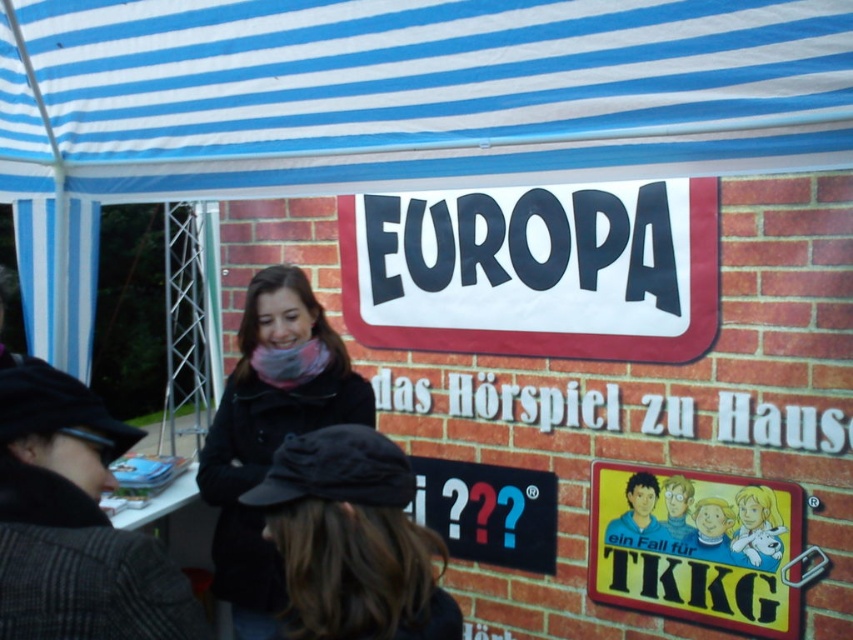
You are standing in front of the brick wall and want to hang a small picture frame that is 10 inches wide between the blue striped canopy at upper center and the black matte coat at center. Is there enough space between them to fit the frame?

The blue striped canopy at upper center is 28.84 inches away from the black matte coat at center. Since the distance between them is greater than 10 inches, the picture frame can be placed between them.

You are standing in front of the brick wall and want to hang a new sign between the blue striped canopy at upper center and the black matte coat at center. Based on their positions, which object should the new sign be placed closer to?

The new sign should be placed closer to the black matte coat at center because the blue striped canopy at upper center is closer to the viewer than the black matte coat at center, so placing it between them would require positioning it nearer to the farther object.

In the scene shown: You are an investigator looking for clues on the brick wall under the blue and white striped canopy tent. You notice the black fabric cap at center. Based on the coordinates provided, can you determine its exact location relative to the large sign with the word

The black fabric cap at center is located at coordinates point (351,540), which places it below the large sign with the word